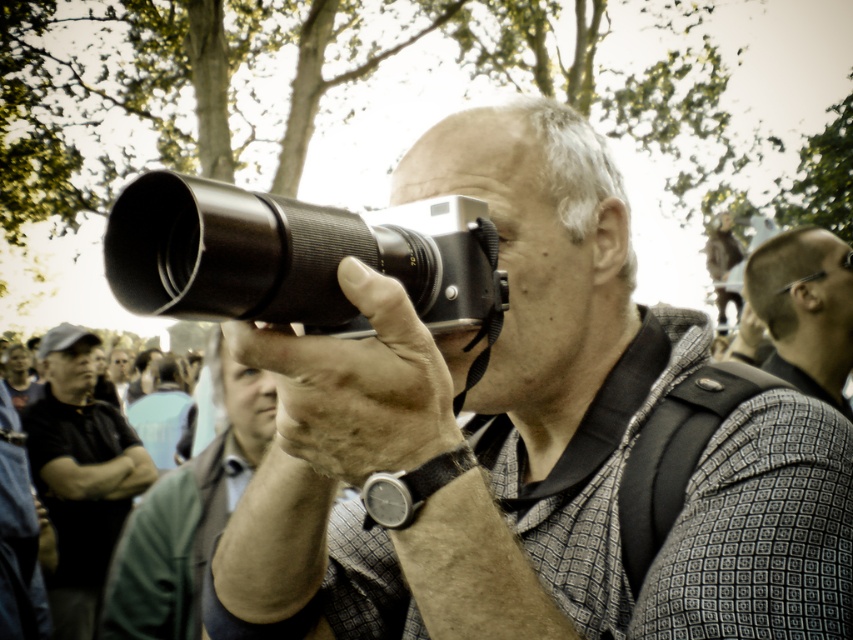
Between point (308, 248) and point (811, 268), which one is positioned behind?

The point (811, 268) is behind.

Does silver metallic camera at center have a greater width compared to shiny black hair at upper right?

In fact, silver metallic camera at center might be narrower than shiny black hair at upper right.

Who is more distant from viewer, (123, 259) or (804, 371)?

The point (804, 371) is more distant.

Locate an element on the screen. silver metallic camera at center is located at coordinates (292, 257).

Consider the image. Does matte black camera at center have a larger size compared to silver metallic camera at center?

Correct, matte black camera at center is larger in size than silver metallic camera at center.

Who is more forward, (534, 259) or (399, 230)?

Point (399, 230) is more forward.

This screenshot has height=640, width=853. What do you see at coordinates (467, 410) in the screenshot?
I see `matte black camera at center` at bounding box center [467, 410].

At what (x,y) coordinates should I click in order to perform the action: click on matte black camera at center. Please return your answer as a coordinate pair (x, y). Looking at the image, I should click on (467, 410).

Is matte black camera at center wider than green leather jacket at center?

Indeed, matte black camera at center has a greater width compared to green leather jacket at center.

Is matte black camera at center smaller than green leather jacket at center?

Yes.

Does point (614, 433) come closer to viewer compared to point (219, 483)?

Yes, it is.

The width and height of the screenshot is (853, 640). In order to click on matte black camera at center in this screenshot , I will do `click(467, 410)`.